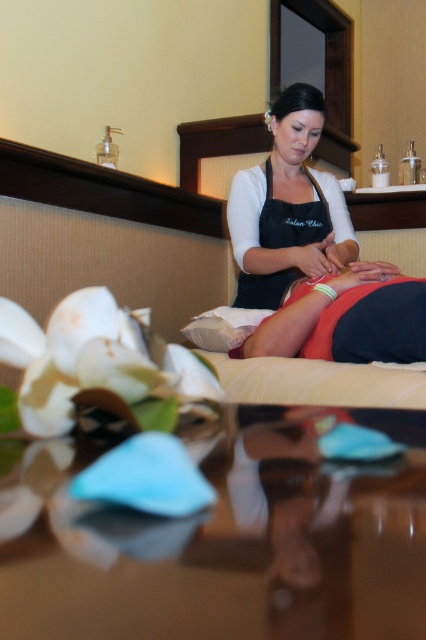
You are a customer at the spa and see two aprons worn by the staff. The black matte apron at center and the black fabric apron at center. Which apron is bigger in size?

The black matte apron at center is larger in size compared to the black fabric apron at center.

You are a customer in the spa and want to identify which apron is closer to you between the black matte apron at center and the black fabric apron at center. Based on their positions, which one should you point out?

The black matte apron at center is located above the black fabric apron at center, so the black matte apron at center is closer to you.